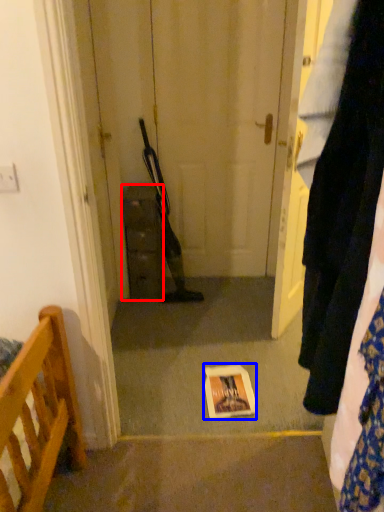
Question: Among these objects, which one is farthest to the camera, cabinetry (highlighted by a red box) or copy (highlighted by a blue box)?

Choices:
 (A) cabinetry
 (B) copy

Answer: (A)